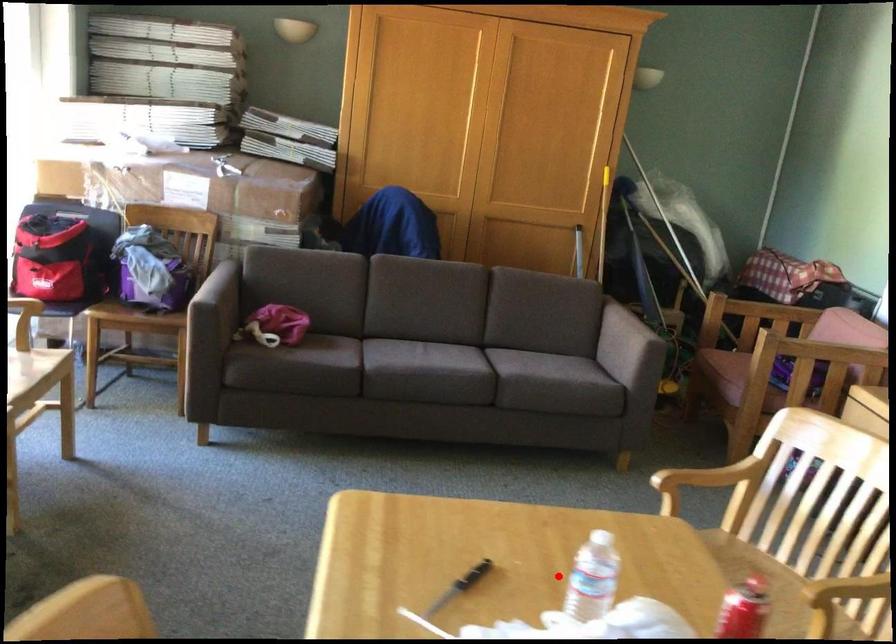
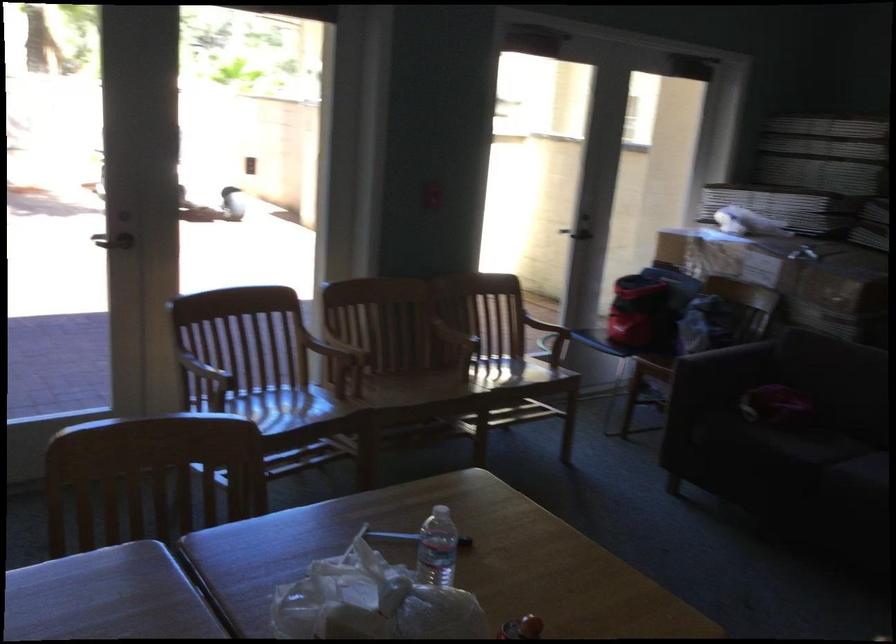
Find the pixel in the second image that matches the highlighted location in the first image.

(437, 547)